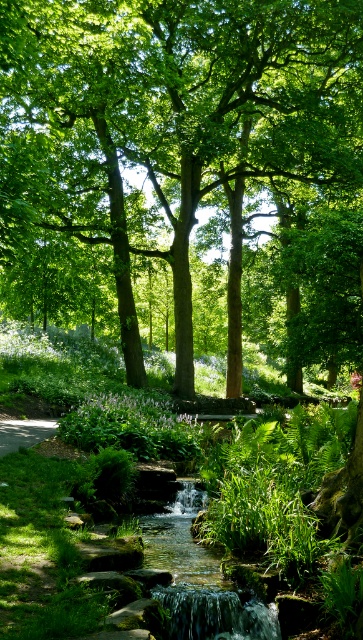
Question: Does green leafy tree at center have a larger size compared to smooth concrete path at lower left?

Choices:
 (A) yes
 (B) no

Answer: (A)

Question: Which point is closer to the camera?

Choices:
 (A) smooth concrete path at lower left
 (B) green leafy tree at center

Answer: (B)

Question: Is green leafy tree at center further to camera compared to smooth concrete path at lower left?

Choices:
 (A) yes
 (B) no

Answer: (B)

Question: Which point appears farthest from the camera in this image?

Choices:
 (A) (325, 128)
 (B) (42, 435)

Answer: (A)

Question: Is green leafy tree at center thinner than smooth concrete path at lower left?

Choices:
 (A) yes
 (B) no

Answer: (B)